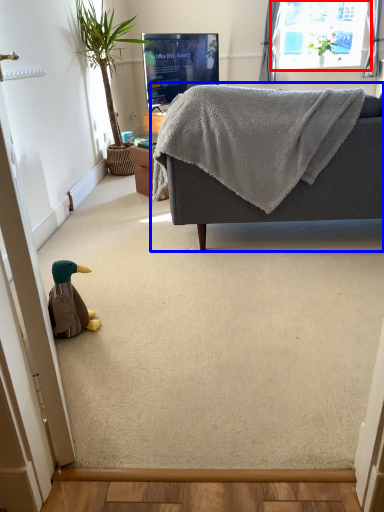
Question: Which point is closer to the camera, window (highlighted by a red box) or studio couch (highlighted by a blue box)?

Choices:
 (A) window
 (B) studio couch

Answer: (B)